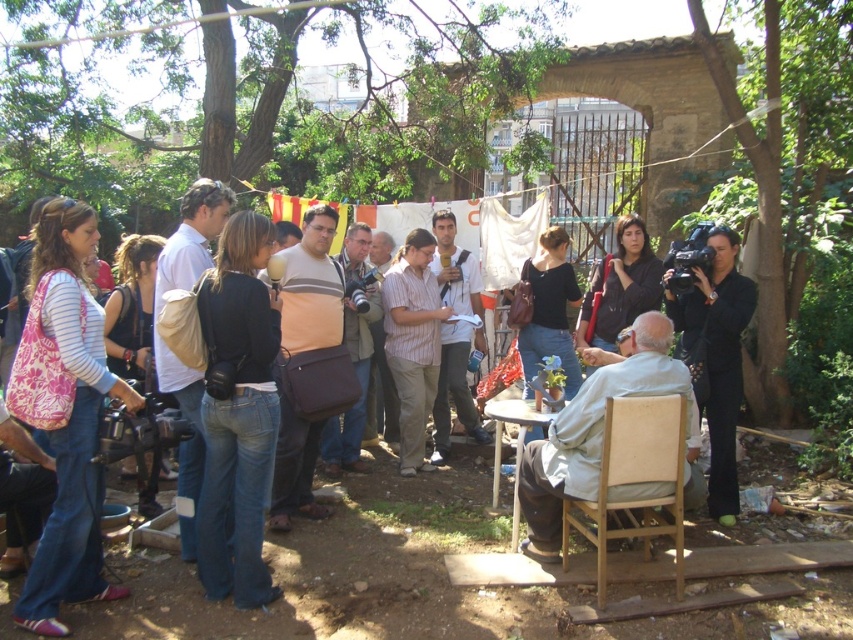
You are a photographer at the event and need to capture a shot of both the light blue fabric at center and the black suit at right. Based on their positions, which object should you position first in your camera frame to ensure both are included?

The light blue fabric at center is to the left of black suit at right, so you should position the light blue fabric at center first in your camera frame to ensure both are included.

You are a photographer trying to capture a closeup shot of the speaker without getting too close. You have a camera with a 3.5 feet focal length. The minimum focusing distance for the matte black camera at center is 3 feet. Can you take a clear photo of the denim jeans at center from your current position?

The distance between the matte black camera at center and the denim jeans at center is 4.25 feet. Since the minimum focusing distance is 3 feet and your camera can focus beyond that, you can take a clear photo as long as you are within the camera range. However, the focal length of 3.5 feet would allow you to zoom in sufficiently from that distance.